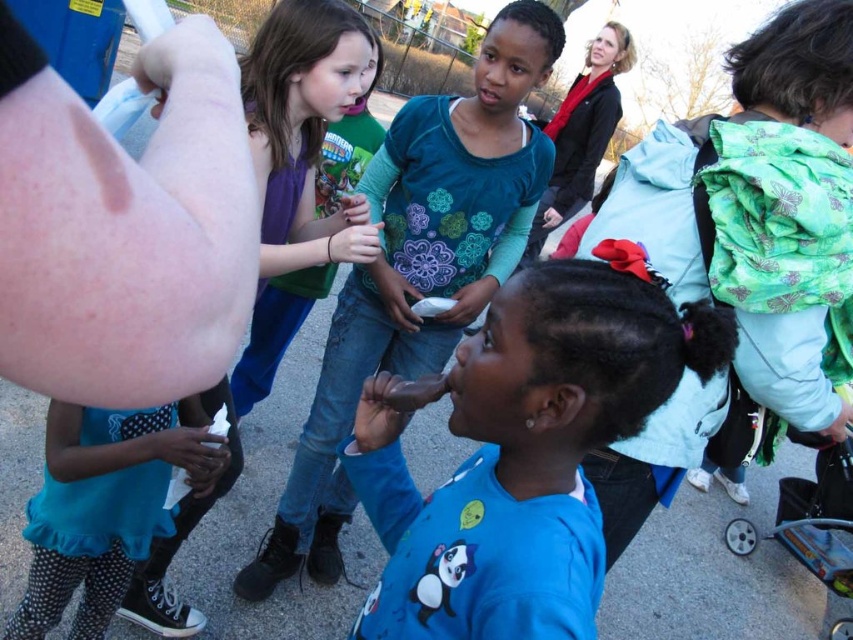
You are a tailor trying to decide which shirt to recommend for a customer who needs a wider shirt. Which one should you choose between the blue matte shirt at center and the blue cotton shirt at center?

The blue cotton shirt at center has a greater width compared to the blue matte shirt at center, so you should recommend the blue cotton shirt at center.